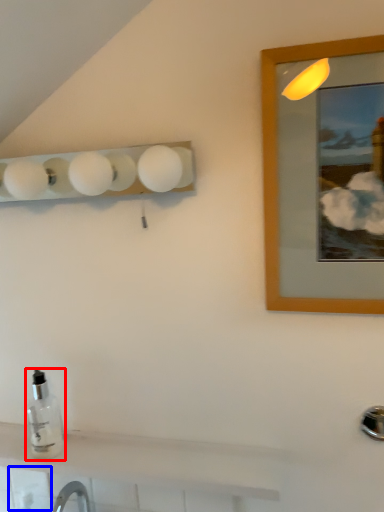
Question: Which point is closer to the camera, bottle (highlighted by a red box) or tile (highlighted by a blue box)?

Choices:
 (A) bottle
 (B) tile

Answer: (A)